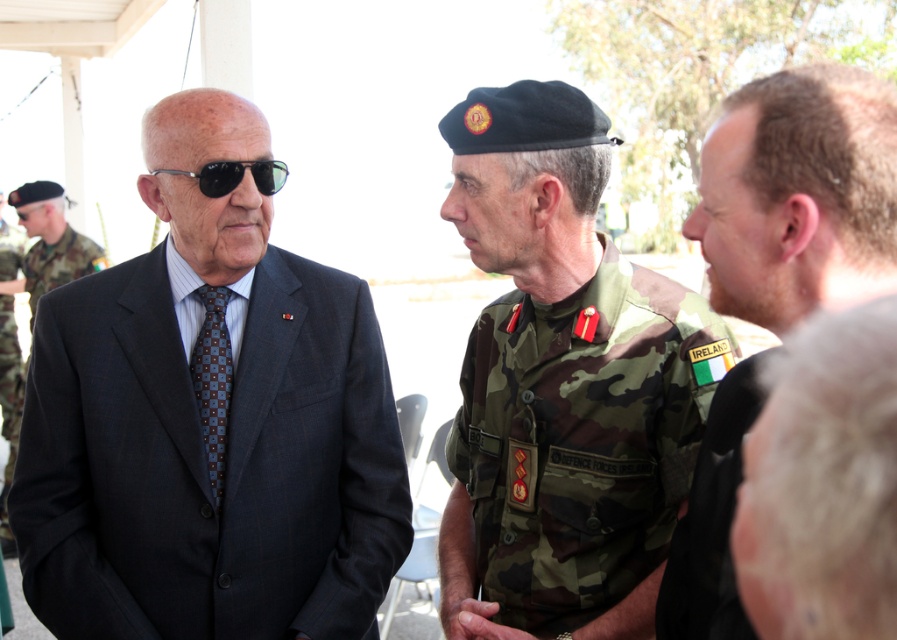
Question: Can you confirm if matte black suit at left is smaller than camouflage fabric military uniform at center?

Choices:
 (A) yes
 (B) no

Answer: (A)

Question: Can you confirm if matte black suit at left is thinner than blue textured tie at center?

Choices:
 (A) yes
 (B) no

Answer: (B)

Question: Which point is closer to the camera taking this photo?

Choices:
 (A) (778, 282)
 (B) (210, 440)
 (C) (319, 637)

Answer: (A)

Question: Considering the real-world distances, which object is closest to the camouflage fabric military uniform at center?

Choices:
 (A) matte black suit at left
 (B) blue textured tie at center
 (C) camouflage uniform at center

Answer: (A)

Question: Estimate the real-world distances between objects in this image. Which object is farther from the camouflage uniform at left?

Choices:
 (A) camouflage fabric military uniform at center
 (B) camouflage uniform at center
 (C) blue textured tie at center
 (D) matte black suit at left

Answer: (B)

Question: Does camouflage uniform at left have a greater width compared to black reflective sunglasses at left?

Choices:
 (A) no
 (B) yes

Answer: (B)